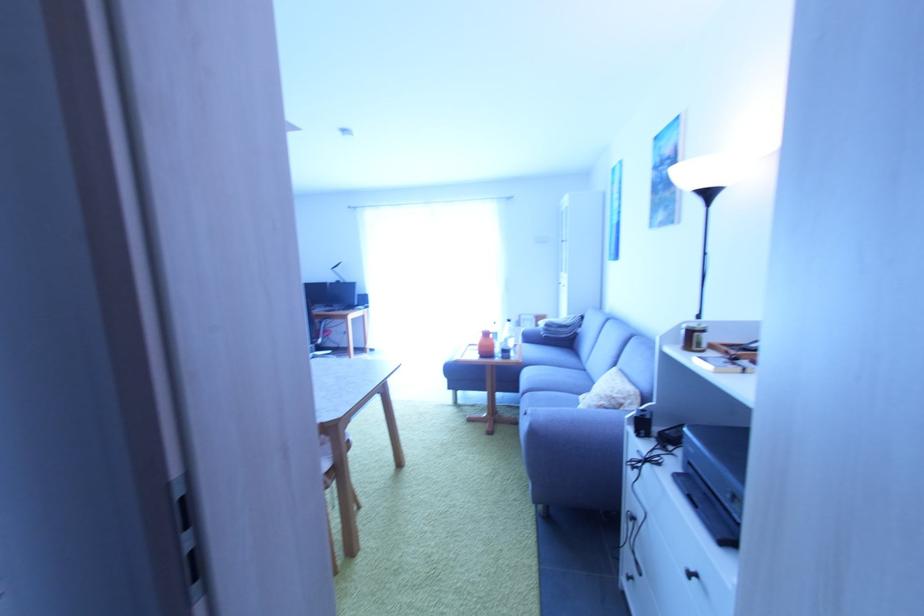
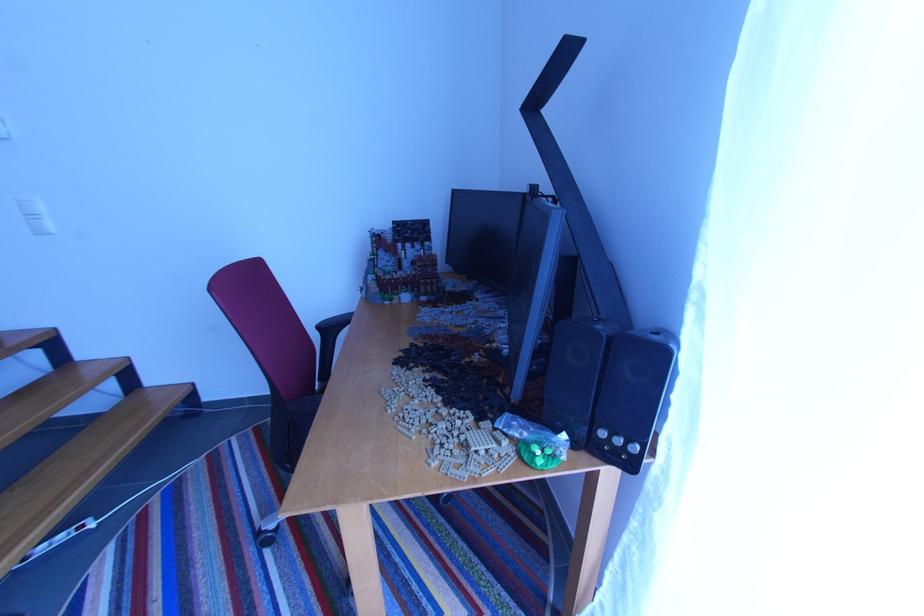
In the second image, find the point that corresponds to (x=371, y=307) in the first image.

(623, 443)